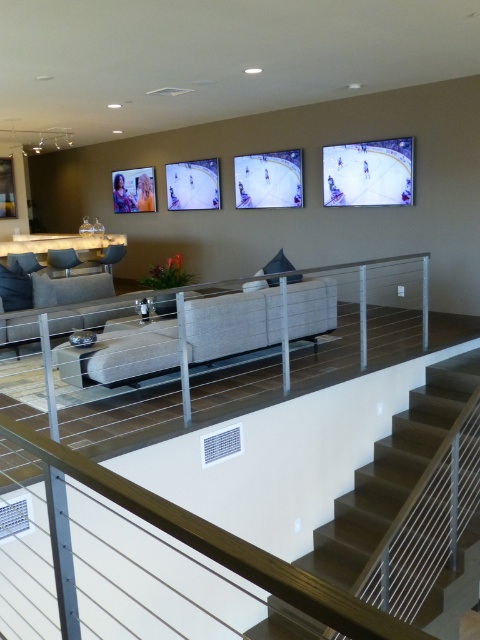
Question: Which point is closer to the camera?

Choices:
 (A) light gray fabric couch at center
 (B) dark brown wooden stairs at center

Answer: (A)

Question: Is dark brown wooden stairs at center further to the viewer compared to light gray fabric couch at center?

Choices:
 (A) no
 (B) yes

Answer: (B)

Question: Is dark brown wooden stairs at center to the right of light gray fabric couch at center from the viewer's perspective?

Choices:
 (A) no
 (B) yes

Answer: (B)

Question: Is dark brown wooden stairs at center to the left of light gray fabric couch at center from the viewer's perspective?

Choices:
 (A) no
 (B) yes

Answer: (A)